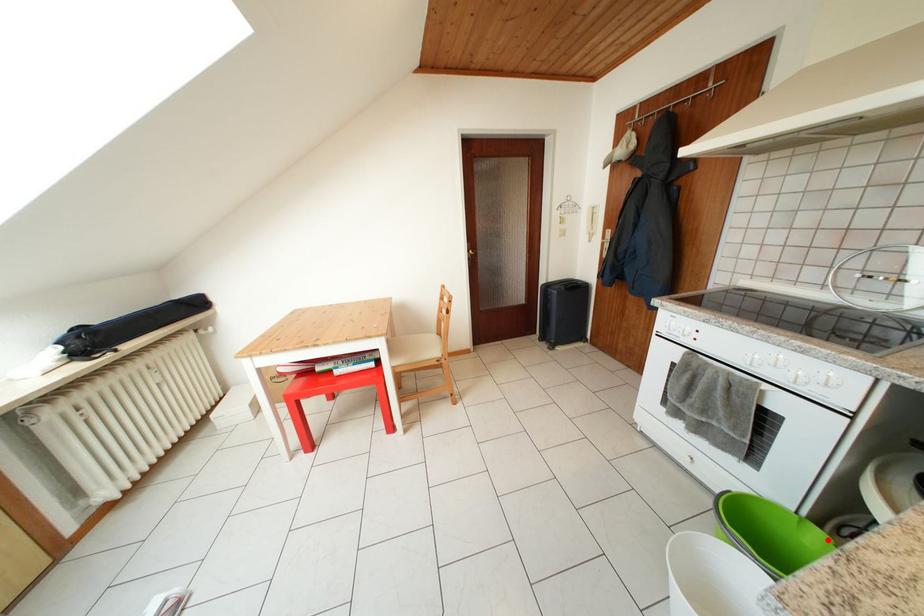
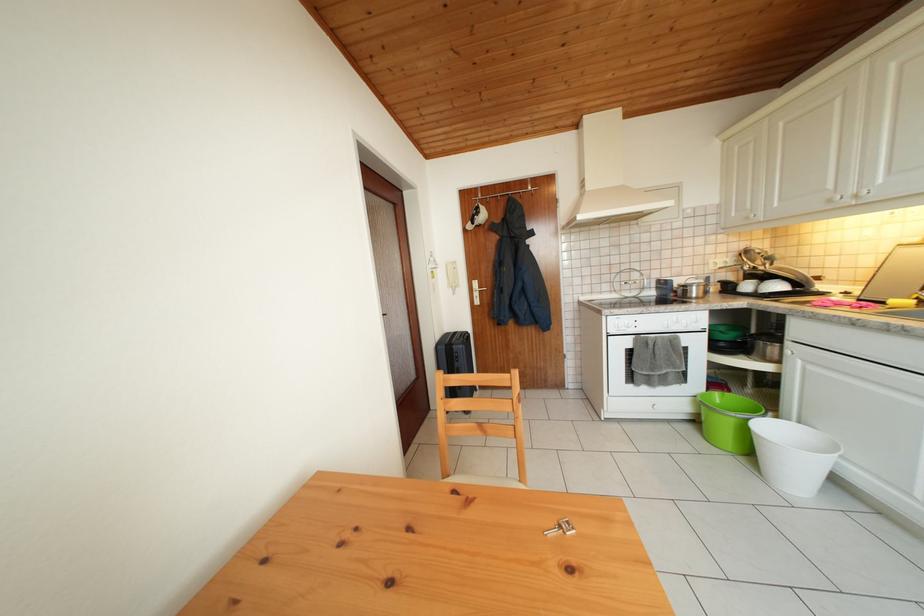
Question: I am providing you with two images of the same scene from different viewpoints. Image1 has a red point marked. In image2, the corresponding 3D location appears at what relative position? Reply with the corresponding letter.

Choices:
 (A) Closer
 (B) Farther

Answer: (A)